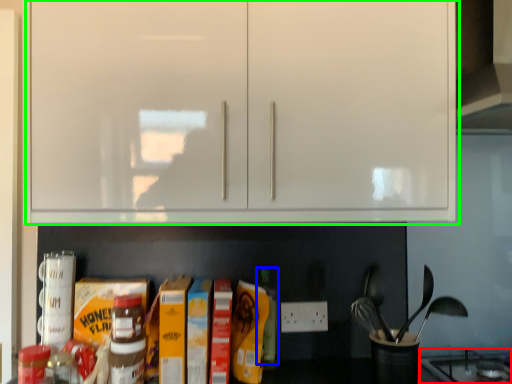
Question: Based on their relative distances, which object is farther from gas stove (highlighted by a red box)? Choose from bottle (highlighted by a blue box) and cabinetry (highlighted by a green box).

Choices:
 (A) bottle
 (B) cabinetry

Answer: (B)